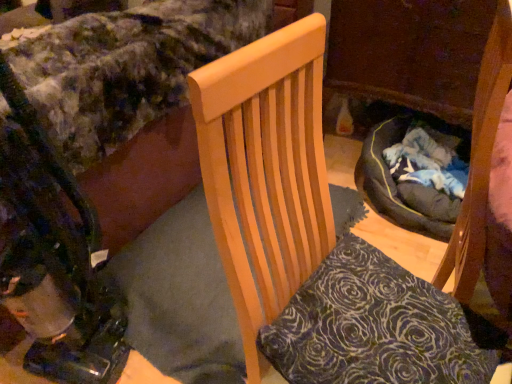
Question: Considering the relative positions of velvety floral bedspread at upper left and wooden chair at center in the image provided, is velvety floral bedspread at upper left to the left of wooden chair at center from the viewer's perspective?

Choices:
 (A) no
 (B) yes

Answer: (B)

Question: Is velvety floral bedspread at upper left facing away from wooden chair at center?

Choices:
 (A) yes
 (B) no

Answer: (A)

Question: Can you confirm if velvety floral bedspread at upper left is smaller than wooden chair at center?

Choices:
 (A) no
 (B) yes

Answer: (A)

Question: Does velvety floral bedspread at upper left contain wooden chair at center?

Choices:
 (A) yes
 (B) no

Answer: (B)

Question: Considering the relative sizes of velvety floral bedspread at upper left and wooden chair at center in the image provided, is velvety floral bedspread at upper left shorter than wooden chair at center?

Choices:
 (A) yes
 (B) no

Answer: (A)

Question: In the image, is wooden chair at center positioned in front of or behind velvety dark blue pillow at center?

Choices:
 (A) front
 (B) behind

Answer: (A)

Question: From a real-world perspective, relative to velvety dark blue pillow at center, is wooden chair at center vertically above or below?

Choices:
 (A) above
 (B) below

Answer: (A)

Question: From the image's perspective, relative to velvety dark blue pillow at center, is wooden chair at center above or below?

Choices:
 (A) below
 (B) above

Answer: (B)

Question: Is point click(221, 87) positioned closer to the camera than point click(394, 380)?

Choices:
 (A) farther
 (B) closer

Answer: (B)

Question: Based on their sizes in the image, would you say velvety floral bedspread at upper left is bigger or smaller than metallic black baby carriage at lower left?

Choices:
 (A) big
 (B) small

Answer: (A)

Question: From a real-world perspective, relative to metallic black baby carriage at lower left, is velvety floral bedspread at upper left vertically above or below?

Choices:
 (A) below
 (B) above

Answer: (A)

Question: Considering the positions of point (153, 178) and point (30, 223), is point (153, 178) closer or farther from the camera than point (30, 223)?

Choices:
 (A) farther
 (B) closer

Answer: (A)

Question: From the image's perspective, is velvety floral bedspread at upper left positioned above or below metallic black baby carriage at lower left?

Choices:
 (A) above
 (B) below

Answer: (A)

Question: From a real-world perspective, is velvety dark blue pillow at center positioned above or below metallic black baby carriage at lower left?

Choices:
 (A) below
 (B) above

Answer: (A)

Question: Considering the positions of point (282, 319) and point (27, 105), is point (282, 319) closer or farther from the camera than point (27, 105)?

Choices:
 (A) farther
 (B) closer

Answer: (B)